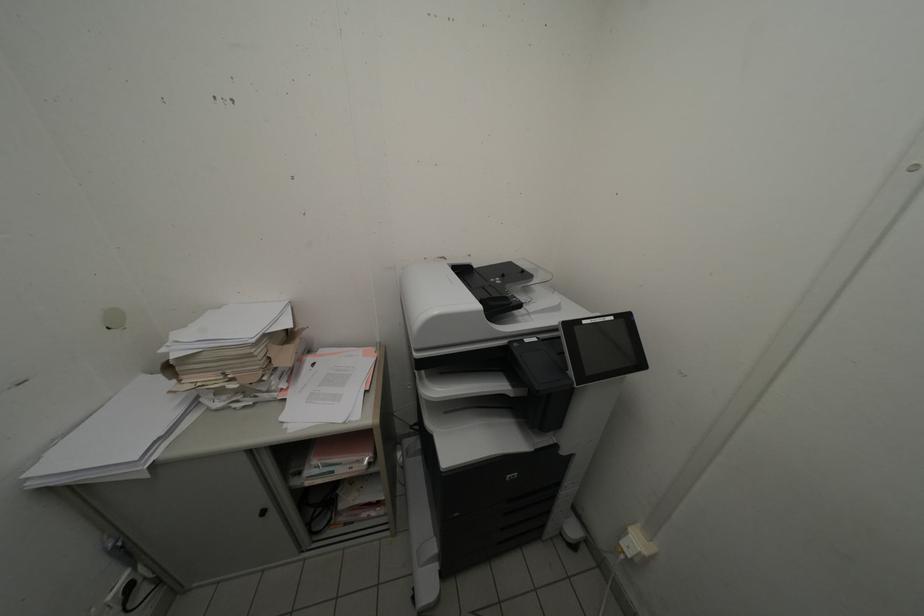
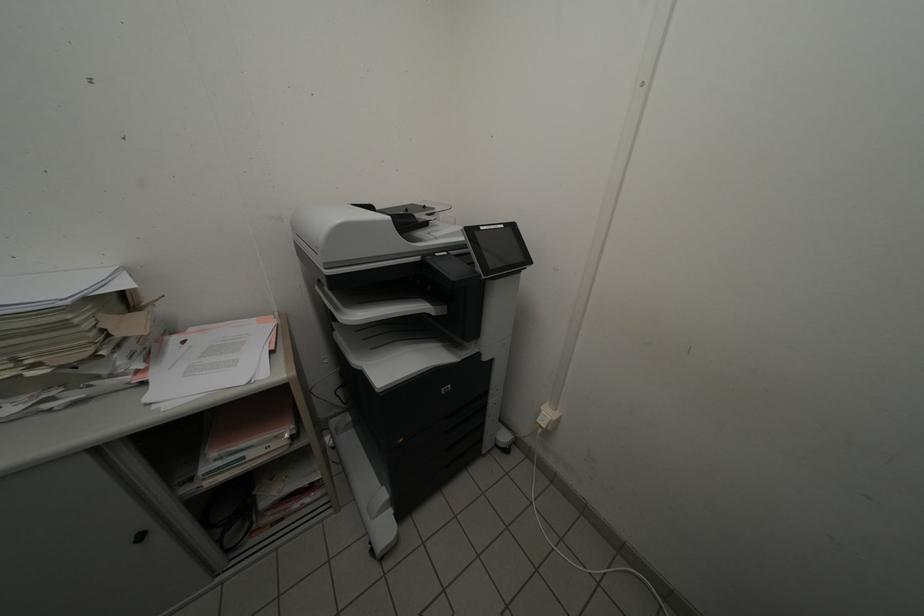
In the second image, find the point that corresponds to the point at 629,546 in the first image.

(546, 424)